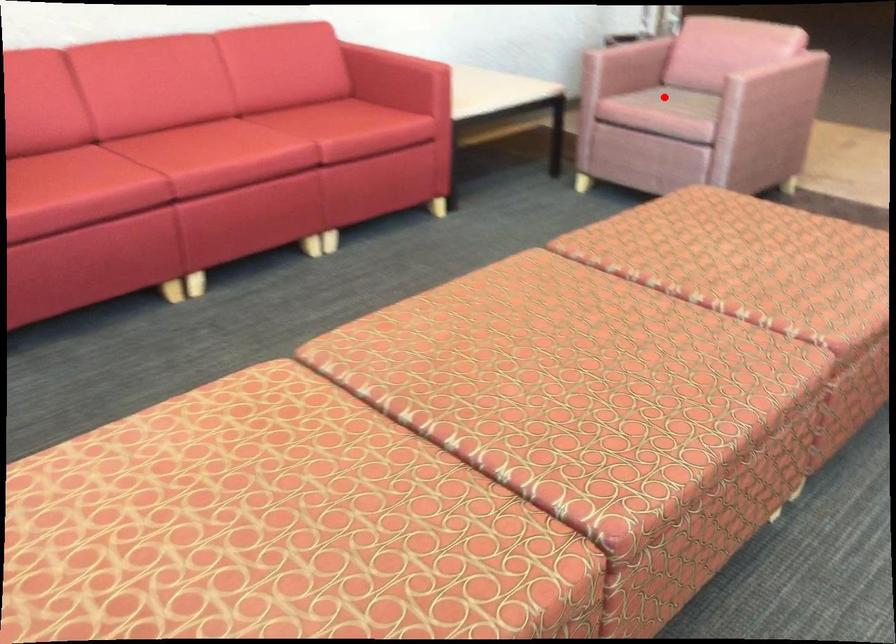
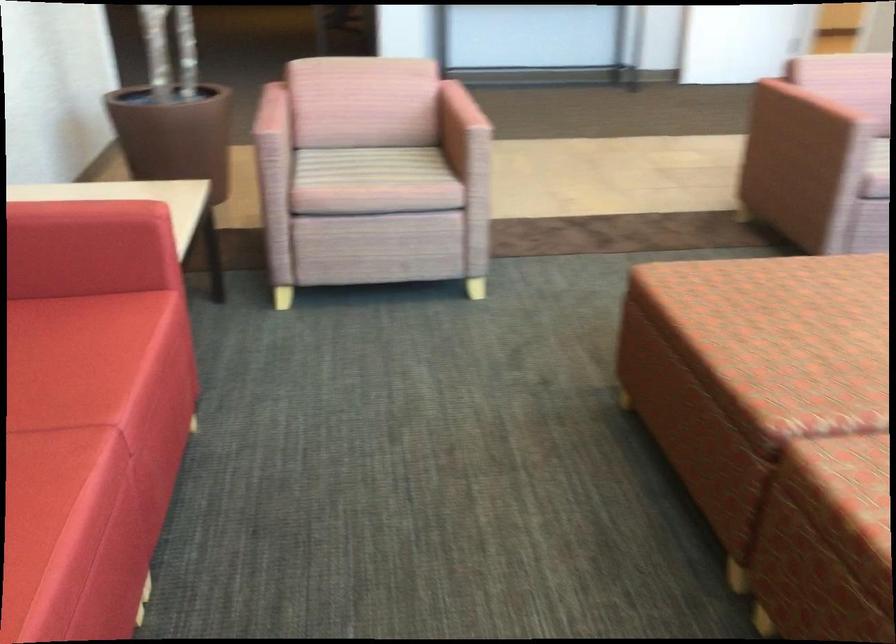
In the second image, find the point that corresponds to the highlighted location in the first image.

(365, 166)